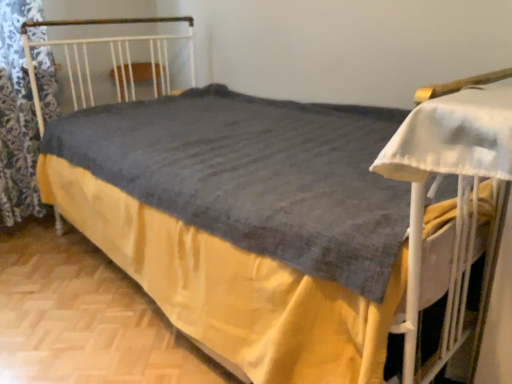
The height and width of the screenshot is (384, 512). Find the location of `free area below floral fabric curtain at left (from a real-world perspective)`. free area below floral fabric curtain at left (from a real-world perspective) is located at coordinates (28, 224).